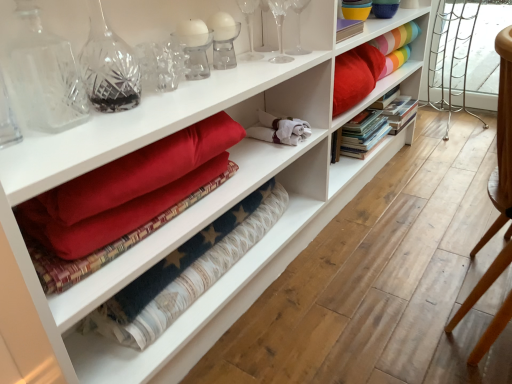
Where is `empty space that is ontop of white textured fabric at center`? The height and width of the screenshot is (384, 512). empty space that is ontop of white textured fabric at center is located at coordinates (203, 254).